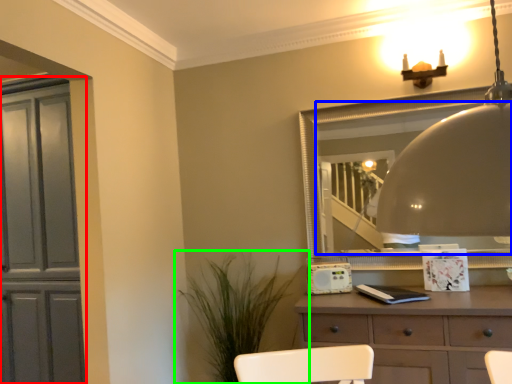
Question: Considering the real-world distances, which object is closest to cabinetry (highlighted by a red box)? mirror (highlighted by a blue box) or houseplant (highlighted by a green box).

Choices:
 (A) mirror
 (B) houseplant

Answer: (B)